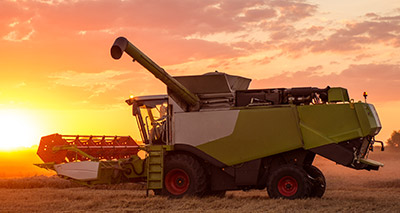
At what (x,y) coordinates should I click in order to perform the action: click on ladder. Please return your answer as a coordinate pair (x, y). The width and height of the screenshot is (400, 213). Looking at the image, I should click on (153, 167).